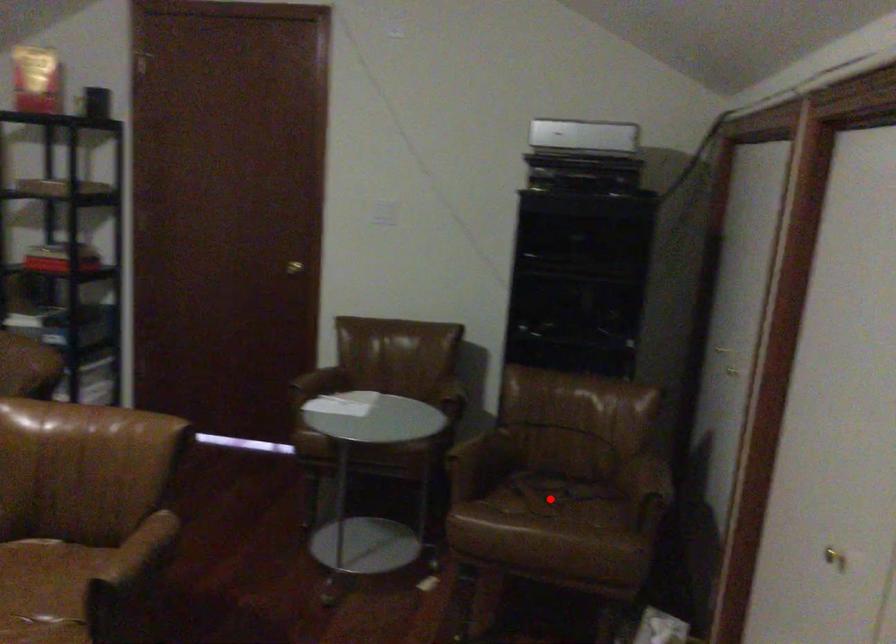
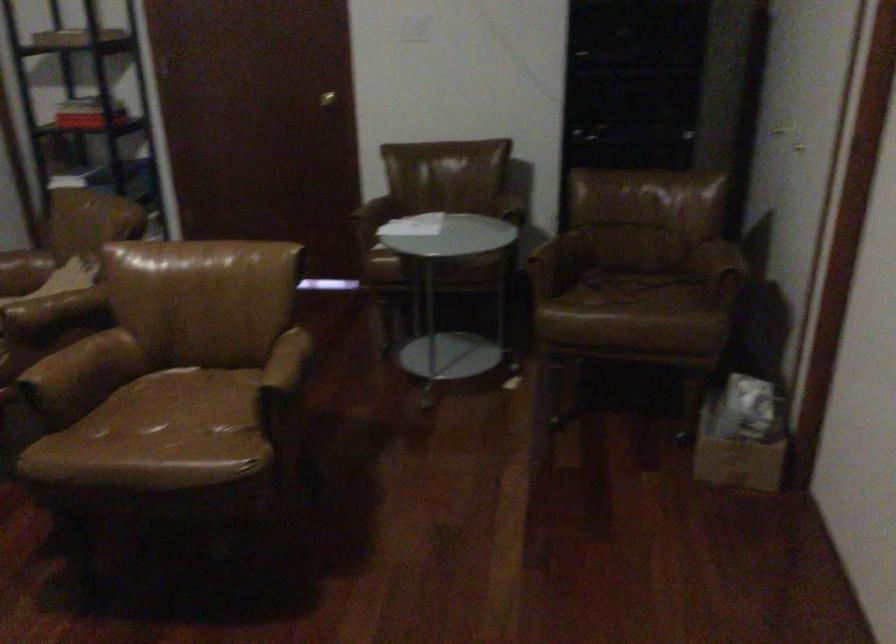
The point at the highlighted location is marked in the first image. Where is the corresponding point in the second image?

(627, 288)